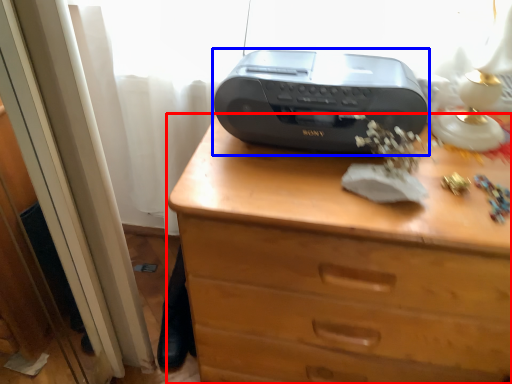
Question: Which object appears farthest to the camera in this image, chest of drawers (highlighted by a red box) or printer (highlighted by a blue box)?

Choices:
 (A) chest of drawers
 (B) printer

Answer: (B)